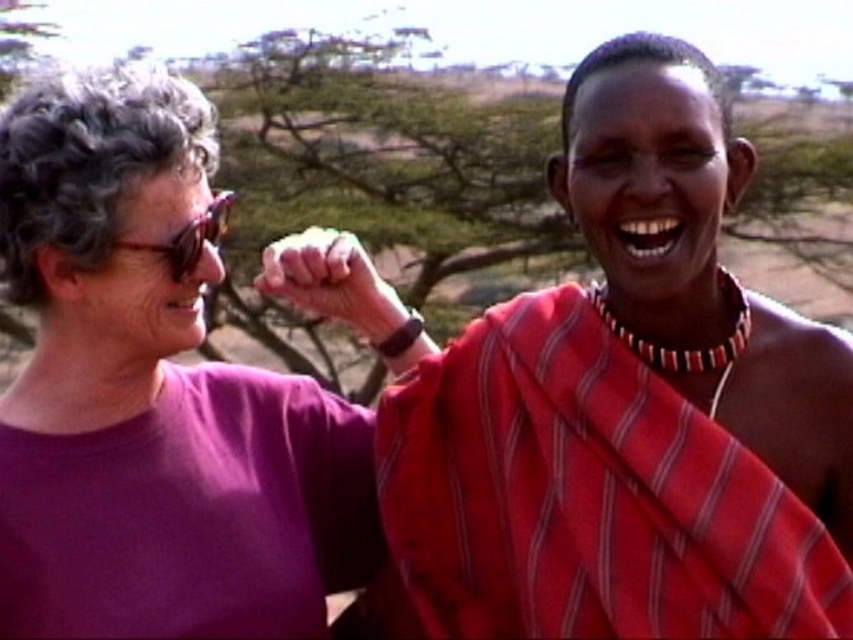
Is point (430, 566) behind point (112, 221)?

Yes, it is.

Is red striped cloth at center to the right of purple matte shirt at left from the viewer's perspective?

Correct, you'll find red striped cloth at center to the right of purple matte shirt at left.

Who is more forward, [666,413] or [265,609]?

Point [666,413] is more forward.

I want to click on red striped cloth at center, so click(x=630, y=406).